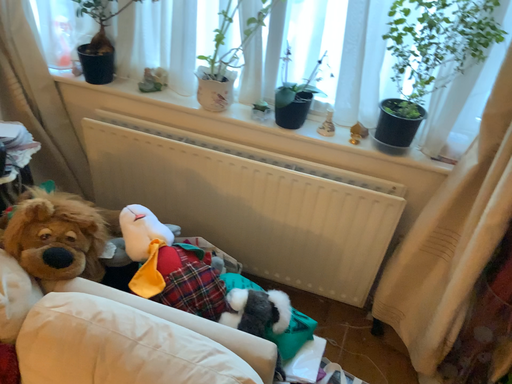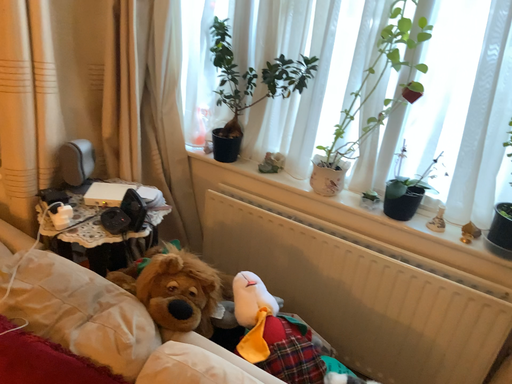
Question: Which way did the camera rotate in the video?

Choices:
 (A) rotated left
 (B) rotated right

Answer: (A)